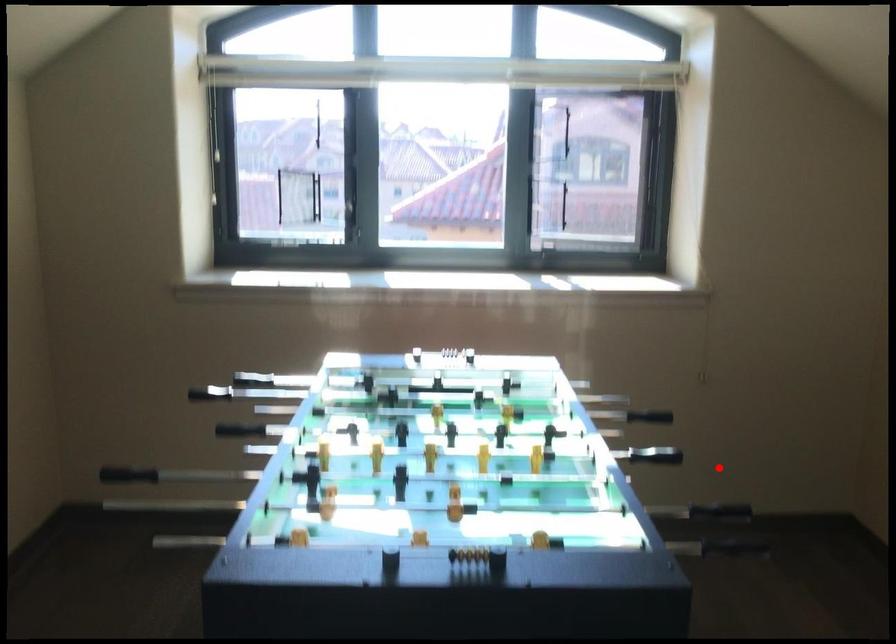
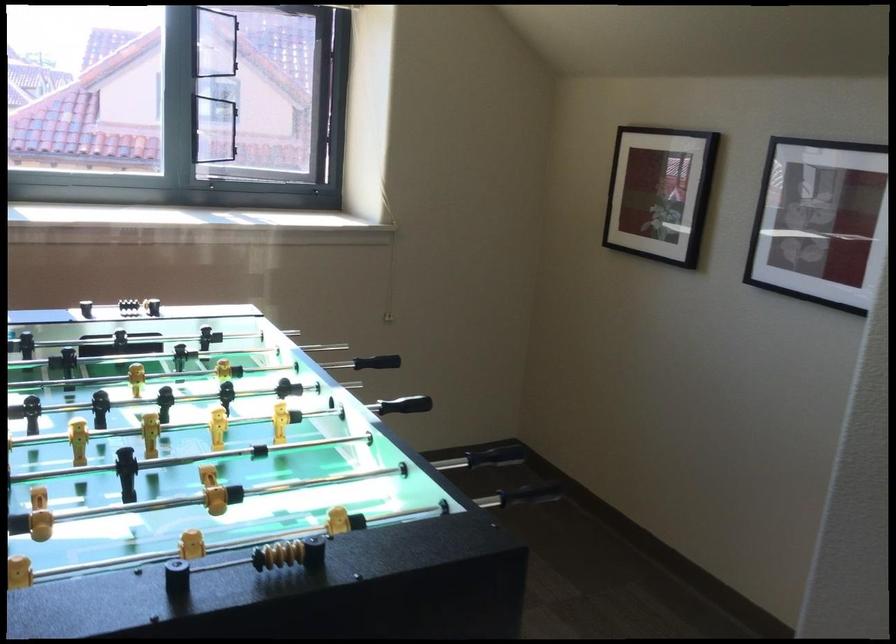
Where in the second image is the point corresponding to the highlighted location from the first image?

(406, 404)